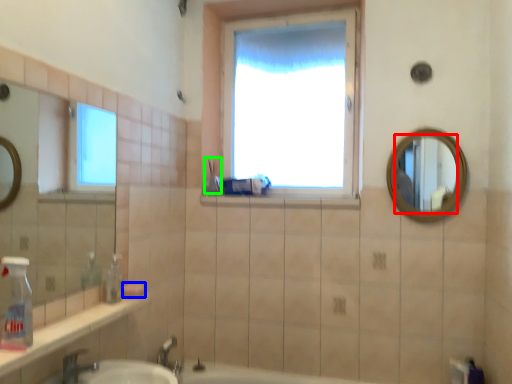
Question: Considering the real-world distances, which object is farthest from mirror (highlighted by a red box)? soap (highlighted by a blue box) or toiletry (highlighted by a green box)?

Choices:
 (A) soap
 (B) toiletry

Answer: (A)